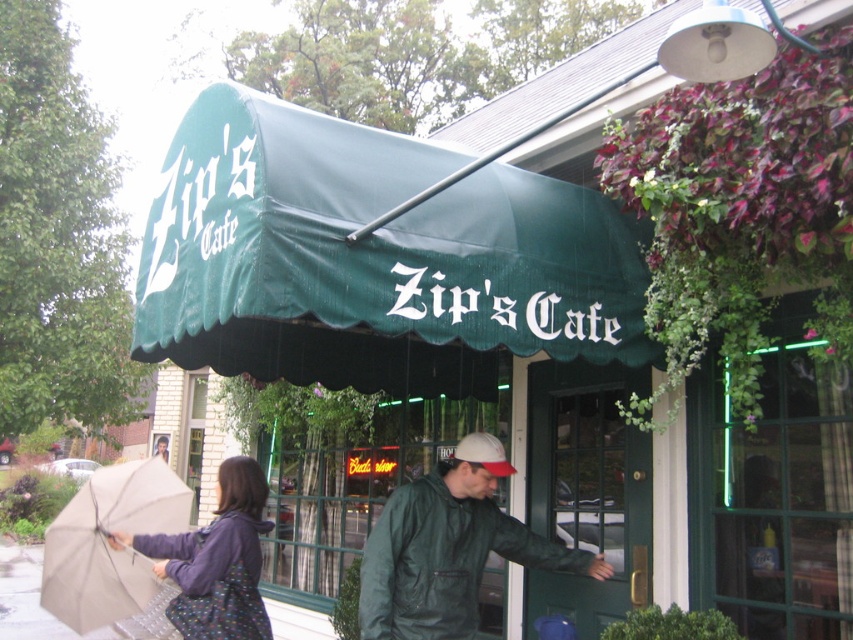
Question: Which point is closer to the camera?

Choices:
 (A) (347, 374)
 (B) (305, 595)

Answer: (A)

Question: Is beige fabric umbrella at lower left above matte purple jacket at lower left?

Choices:
 (A) yes
 (B) no

Answer: (B)

Question: Among these objects, which one is nearest to the camera?

Choices:
 (A) gray concrete pavement at lower left
 (B) beige fabric umbrella at lower left

Answer: (B)

Question: Based on their relative distances, which object is farther from the green matte jacket at center?

Choices:
 (A) matte purple jacket at lower left
 (B) green fabric awning at upper center
 (C) beige fabric umbrella at lower left

Answer: (C)

Question: Does green fabric awning at upper center appear under beige fabric umbrella at lower left?

Choices:
 (A) yes
 (B) no

Answer: (B)

Question: Can you confirm if green fabric awning at upper center is positioned below gray concrete pavement at lower left?

Choices:
 (A) yes
 (B) no

Answer: (B)